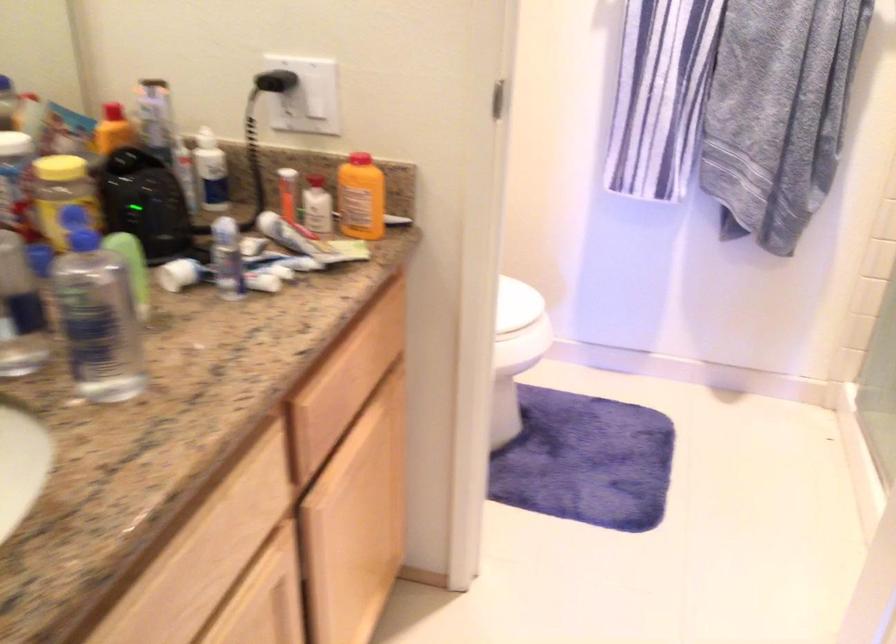
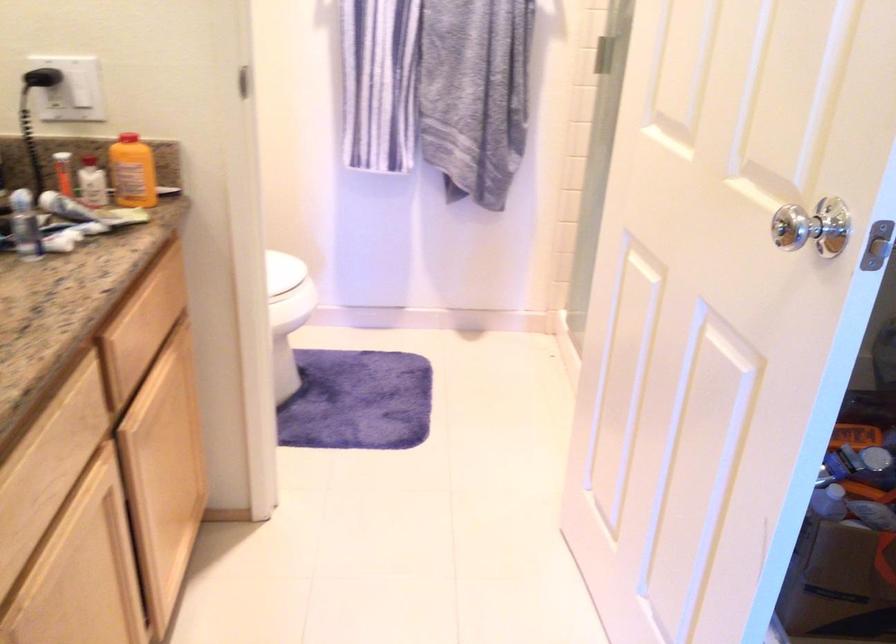
Find the pixel in the second image that matches the point at 350,198 in the first image.

(133, 172)